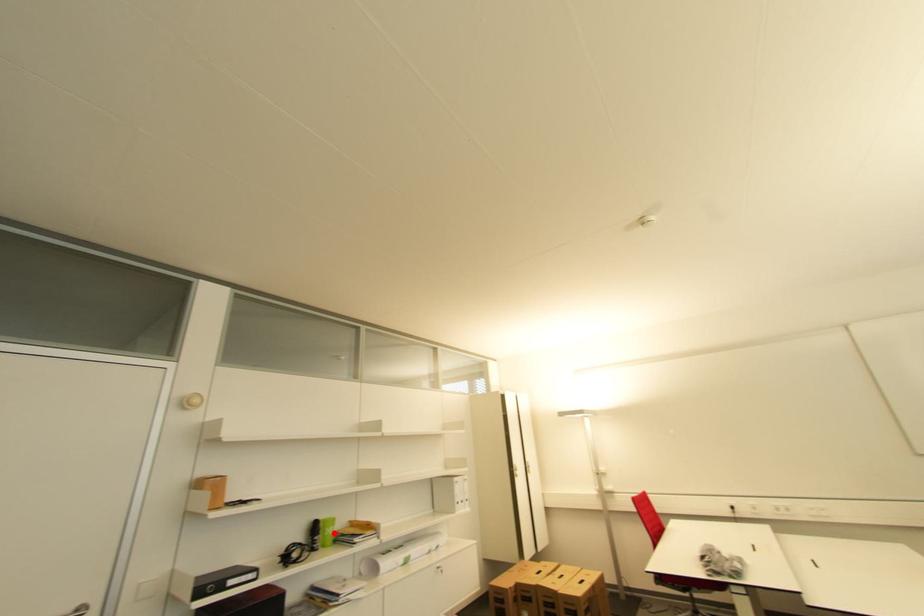
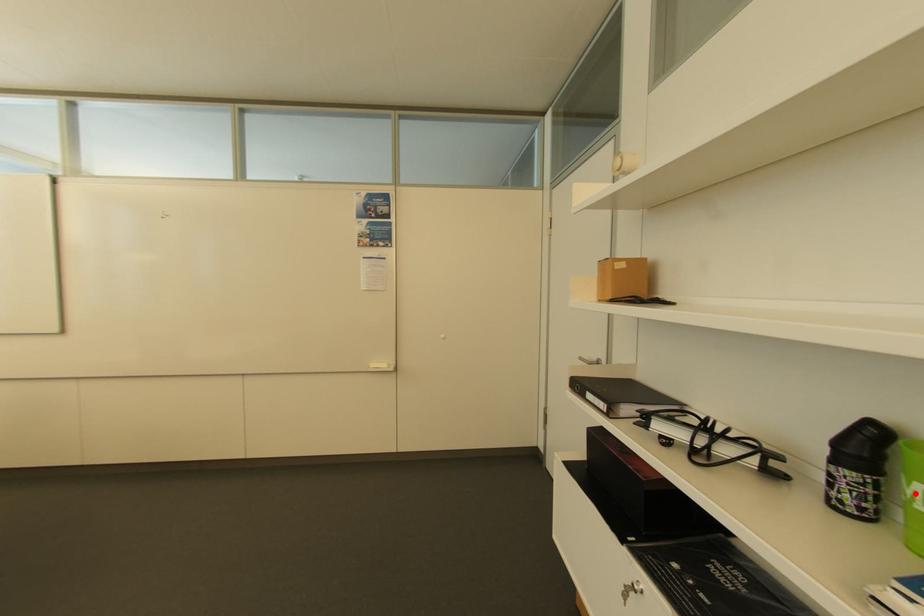
I am providing you with two images of the same scene from different viewpoints. A red point is marked on the first image and another point is marked on the second image. Are the points marked in image1 and image2 representing the same 3D position?

Yes